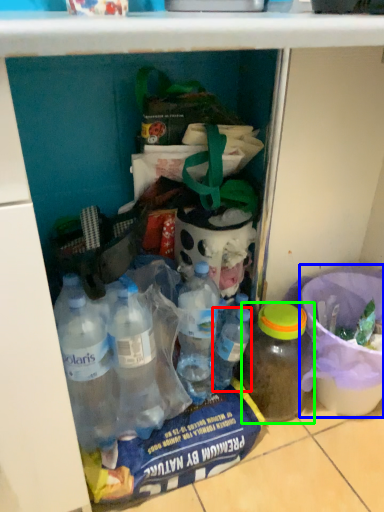
Question: Which is farther away from bottle (highlighted by a red box)? bucket (highlighted by a blue box) or bottle (highlighted by a green box)?

Choices:
 (A) bucket
 (B) bottle

Answer: (A)